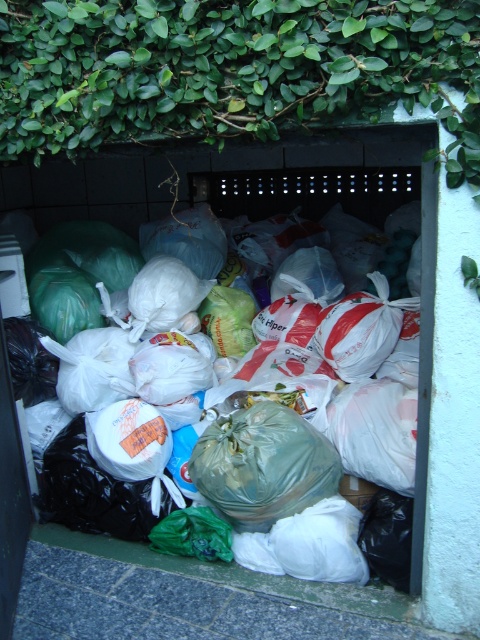
Does gray concrete pavement at lower left have a lesser height compared to translucent plastic bags at center?

Yes, gray concrete pavement at lower left is shorter than translucent plastic bags at center.

Is gray concrete pavement at lower left bigger than translucent plastic bags at center?

No.

Which is behind, point (90, 541) or point (367, 554)?

The point (90, 541) is behind.

You are a GUI agent. You are given a task and a screenshot of the screen. Output one action in this format:
    pyautogui.click(x=<x>, y=<y>)
    Task: Click on the gray concrete pavement at lower left
    The width and height of the screenshot is (480, 640).
    Given the screenshot: What is the action you would take?
    (x=192, y=598)